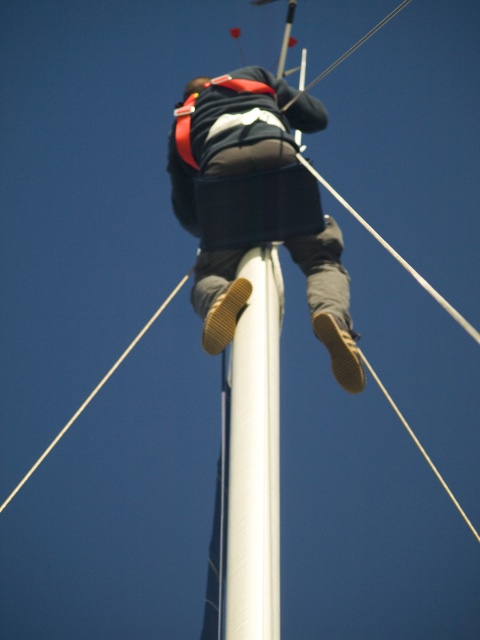
Between matte black jacket at center and white smooth pole at center, which one has less height?

white smooth pole at center is shorter.

Between matte black jacket at center and white smooth pole at center, which one appears on the left side from the viewer's perspective?

Positioned to the left is matte black jacket at center.

Who is more forward, (350, 326) or (272, 266)?

Point (272, 266) is in front.

Locate an element on the screen. The height and width of the screenshot is (640, 480). matte black jacket at center is located at coordinates (255, 205).